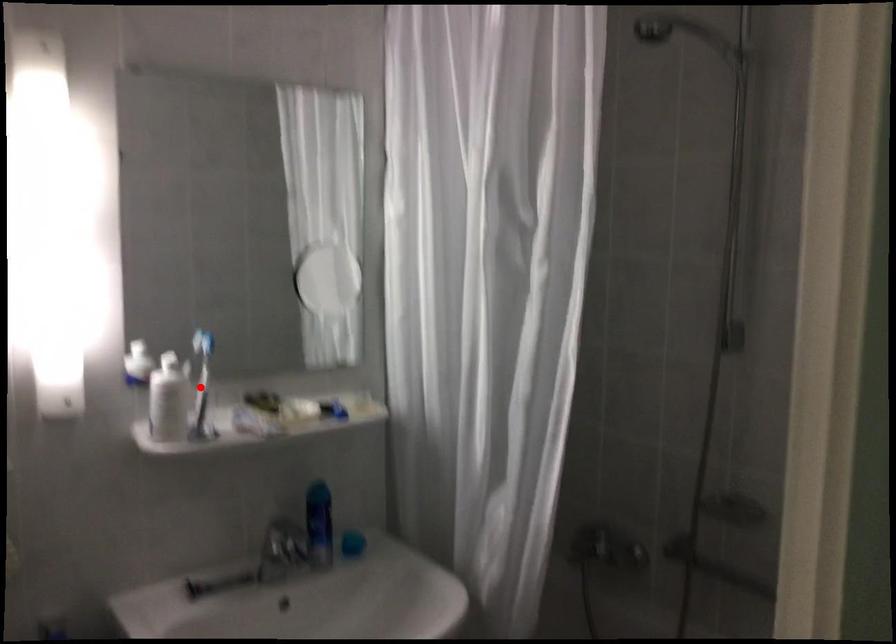
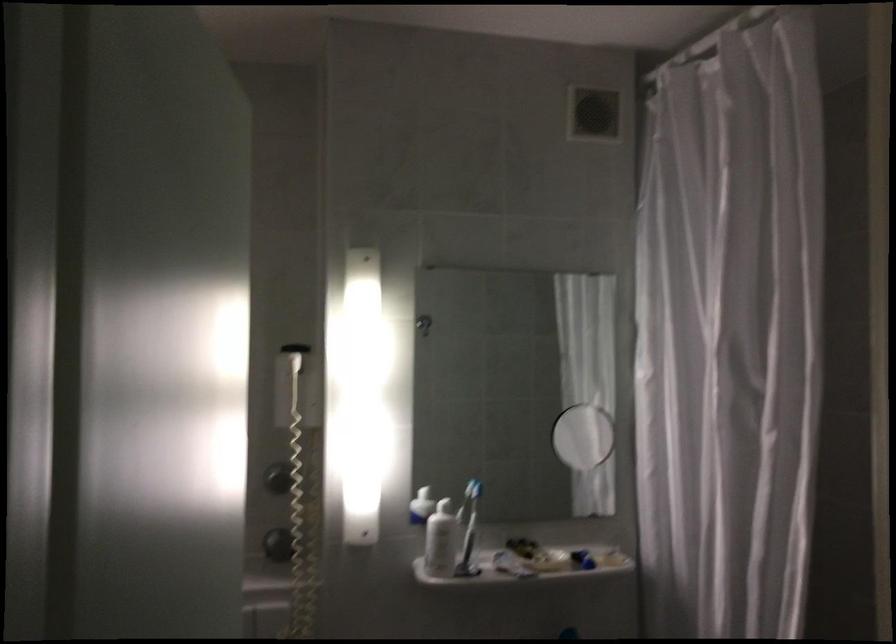
Question: I am providing you with two images of the same scene from different viewpoints. Image1 has a red point marked. In image2, the corresponding 3D location appears at what relative position? Reply with the corresponding letter.

Choices:
 (A) Closer
 (B) Farther

Answer: (B)